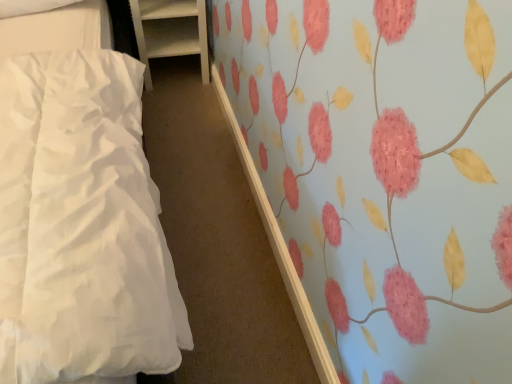
What do you see at coordinates (170, 31) in the screenshot?
I see `white wood shelf at upper left` at bounding box center [170, 31].

Find the location of a particular element. white wood shelf at upper left is located at coordinates (170, 31).

The image size is (512, 384). Find the location of `white satin bed at left`. white satin bed at left is located at coordinates (76, 218).

Describe the element at coordinates (76, 218) in the screenshot. The image size is (512, 384). I see `white satin bed at left` at that location.

You are a GUI agent. You are given a task and a screenshot of the screen. Output one action in this format:
    pyautogui.click(x=<x>, y=<y>)
    Task: Click on the white wood shelf at upper left
    
    Given the screenshot: What is the action you would take?
    tap(170, 31)

In the scene shown: Considering the positions of objects white satin bed at left and white wood shelf at upper left in the image provided, who is more to the right, white satin bed at left or white wood shelf at upper left?

white wood shelf at upper left.

Which is in front, white satin bed at left or white wood shelf at upper left?

white satin bed at left is in front.

Does point (36, 149) lie in front of point (155, 24)?

Yes, it is.

From the image's perspective, is white satin bed at left above white wood shelf at upper left?

No, from the image's perspective, white satin bed at left is not above white wood shelf at upper left.

From a real-world perspective, is white satin bed at left beneath white wood shelf at upper left?

Indeed, from a real-world perspective, white satin bed at left is positioned beneath white wood shelf at upper left.

Is white satin bed at left thinner than white wood shelf at upper left?

No, white satin bed at left is not thinner than white wood shelf at upper left.

Can you confirm if white satin bed at left is shorter than white wood shelf at upper left?

Yes.

Does white satin bed at left have a larger size compared to white wood shelf at upper left?

Incorrect, white satin bed at left is not larger than white wood shelf at upper left.

Would you say white satin bed at left contains white wood shelf at upper left?

No.

Is white satin bed at left far from white wood shelf at upper left?

No, white satin bed at left is not far from white wood shelf at upper left.

Is white satin bed at left oriented towards white wood shelf at upper left?

No, white satin bed at left is not facing towards white wood shelf at upper left.

Locate an element on the screen. Image resolution: width=512 pixels, height=384 pixels. bed located below the white wood shelf at upper left (from the image's perspective) is located at coordinates (76, 218).

Does white wood shelf at upper left appear on the left side of white satin bed at left?

No, white wood shelf at upper left is not to the left of white satin bed at left.

Does white wood shelf at upper left come behind white satin bed at left?

Yes, it is behind white satin bed at left.

Does point (151, 9) appear closer or farther from the camera than point (115, 202)?

Point (151, 9).

From the image's perspective, is white wood shelf at upper left located above or below white satin bed at left?

white wood shelf at upper left is above white satin bed at left.

From a real-world perspective, is white wood shelf at upper left physically below white satin bed at left?

No, from a real-world perspective, white wood shelf at upper left is not beneath white satin bed at left.

Does white wood shelf at upper left have a greater width compared to white satin bed at left?

Incorrect, the width of white wood shelf at upper left does not surpass that of white satin bed at left.

Is white wood shelf at upper left taller than white satin bed at left?

Indeed, white wood shelf at upper left has a greater height compared to white satin bed at left.

Can you confirm if white wood shelf at upper left is bigger than white satin bed at left?

Indeed, white wood shelf at upper left has a larger size compared to white satin bed at left.

Can white satin bed at left be found inside white wood shelf at upper left?

No, white satin bed at left is not a part of white wood shelf at upper left.

Is white wood shelf at upper left not near white satin bed at left?

No, white wood shelf at upper left is not far away from white satin bed at left.

Could you tell me if white wood shelf at upper left is facing white satin bed at left?

Yes, white wood shelf at upper left is turned towards white satin bed at left.

How different are the orientations of white wood shelf at upper left and white satin bed at left in degrees?

The angle between the facing direction of white wood shelf at upper left and the facing direction of white satin bed at left is 0.887 degrees.

How much distance is there between white wood shelf at upper left and white satin bed at left?

35.74 inches.

Identify the location of bed on the left of white wood shelf at upper left. The image size is (512, 384). (76, 218).

Where is `furniture above the white satin bed at left (from a real-world perspective)`? Image resolution: width=512 pixels, height=384 pixels. furniture above the white satin bed at left (from a real-world perspective) is located at coordinates (170, 31).

This screenshot has width=512, height=384. In order to click on bed that appears in front of the white wood shelf at upper left in this screenshot , I will do `click(76, 218)`.